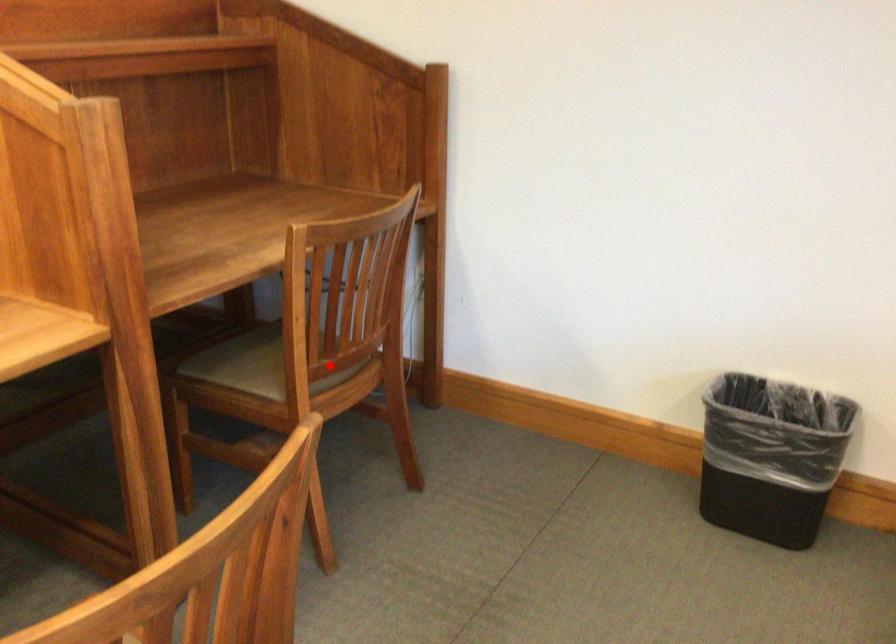
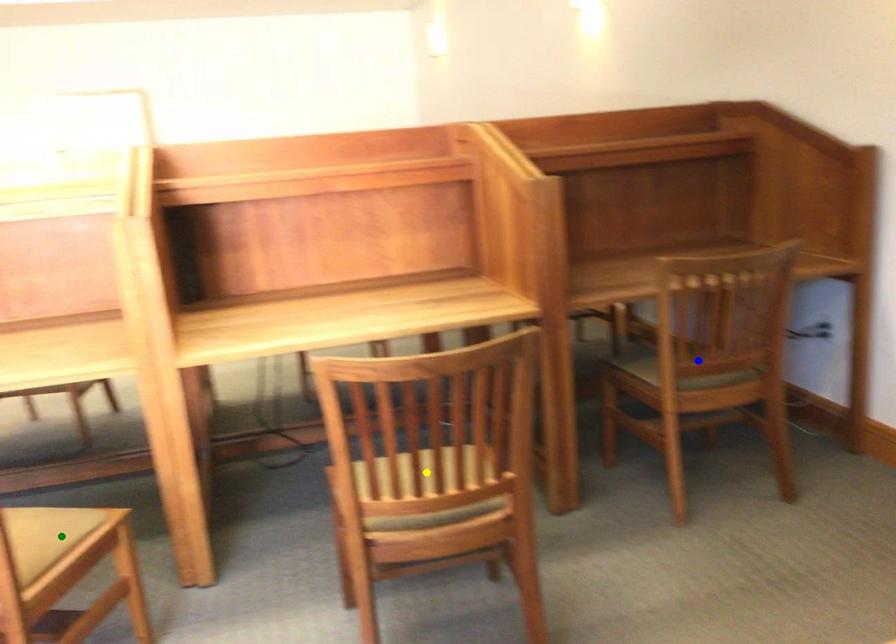
Question: I am providing you with two images of the same scene from different viewpoints. A red point is marked on the first image. You are given multiple points on the second image. Can you choose the point in image 2 that corresponds to the point in image 1?

Choices:
 (A) yellow point
 (B) blue point
 (C) green point

Answer: (B)